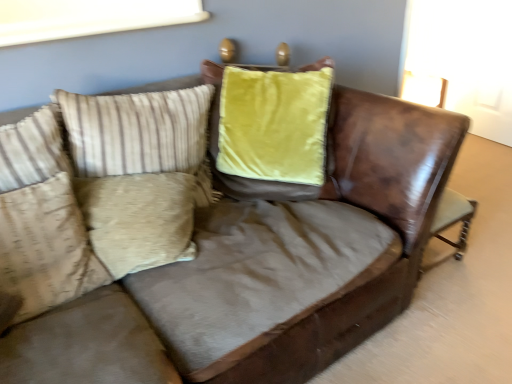
Question: Is beige striped pillow at left, which appears as the 1th pillow when viewed from the top, bigger or smaller than beige fabric pillow at left, the second pillow in the top-to-bottom sequence?

Choices:
 (A) big
 (B) small

Answer: (A)

Question: Is beige striped pillow at left, which appears as the 1th pillow when viewed from the top, inside or outside of beige fabric pillow at left, the 1th pillow in the bottom-to-top sequence?

Choices:
 (A) outside
 (B) inside

Answer: (A)

Question: From a real-world perspective, is beige striped pillow at left, which appears as the 1th pillow when viewed from the top, above or below beige fabric pillow at left, the second pillow in the top-to-bottom sequence?

Choices:
 (A) above
 (B) below

Answer: (A)

Question: Would you say beige fabric pillow at left, the second pillow in the top-to-bottom sequence, is to the left or to the right of beige striped pillow at left, which appears as the 1th pillow when viewed from the top, in the picture?

Choices:
 (A) right
 (B) left

Answer: (B)

Question: Does point (57, 235) appear closer or farther from the camera than point (199, 87)?

Choices:
 (A) closer
 (B) farther

Answer: (A)

Question: Is beige fabric pillow at left, the 1th pillow in the bottom-to-top sequence, spatially inside beige striped pillow at left, the second pillow from the bottom, or outside of it?

Choices:
 (A) outside
 (B) inside

Answer: (A)

Question: From the image's perspective, relative to beige striped pillow at left, the second pillow from the bottom, is beige fabric pillow at left, the 1th pillow in the bottom-to-top sequence, above or below?

Choices:
 (A) above
 (B) below

Answer: (B)